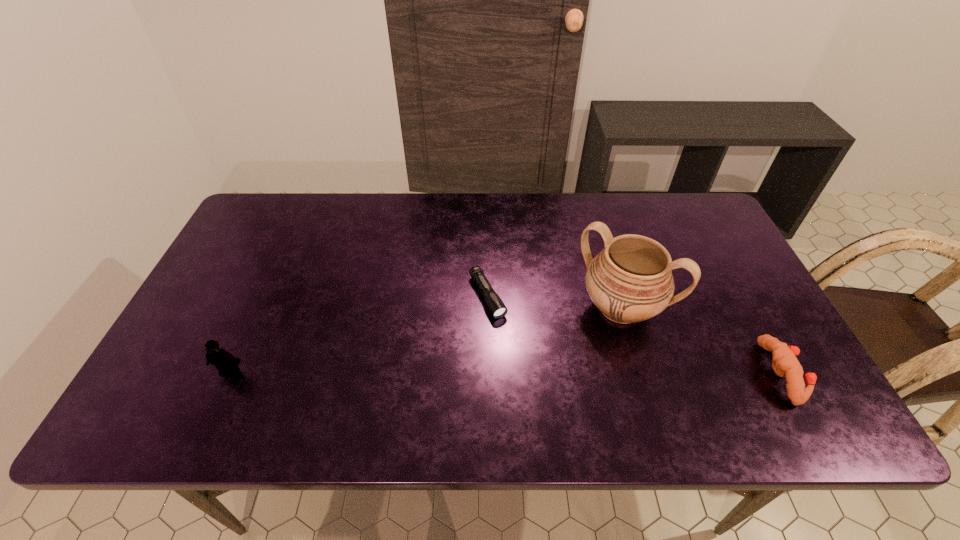
At what (x,y) coordinates should I click in order to perform the action: click on free space that satisfies the following two spatial constraints: 1. on the front side of the shortest object; 2. with the gloves of the puncher facing forward. Please return your answer as a coordinate pair (x, y). This screenshot has width=960, height=540. Looking at the image, I should click on (489, 373).

Locate an element on the screen. free space that satisfies the following two spatial constraints: 1. on the front side of the second shortest object; 2. with the gloves of the tallest object facing forward is located at coordinates click(x=638, y=373).

Identify the location of vacant space that satisfies the following two spatial constraints: 1. on the face of the third tallest object; 2. with the gloves of the second tallest object facing forward. The width and height of the screenshot is (960, 540). (228, 373).